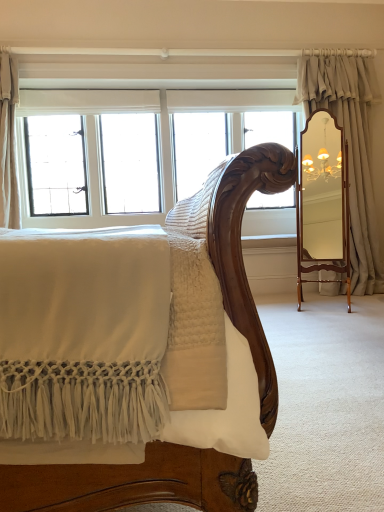
Question: From the image's perspective, is white glass window at upper left beneath beige linen curtain at upper left, which is counted as the 2th curtain, starting from the right?

Choices:
 (A) yes
 (B) no

Answer: (A)

Question: Does white glass window at upper left have a smaller size compared to beige linen curtain at upper left, which is counted as the 2th curtain, starting from the right?

Choices:
 (A) yes
 (B) no

Answer: (B)

Question: Is white glass window at upper left completely or partially outside of beige linen curtain at upper left, which is counted as the 2th curtain, starting from the right?

Choices:
 (A) yes
 (B) no

Answer: (A)

Question: Could you tell me if white glass window at upper left is facing beige linen curtain at upper left, which is the 1th curtain in left-to-right order?

Choices:
 (A) yes
 (B) no

Answer: (A)

Question: From the image's perspective, is white glass window at upper left above beige linen curtain at upper left, which is counted as the 2th curtain, starting from the right?

Choices:
 (A) yes
 (B) no

Answer: (B)

Question: From a real-world perspective, is white glass window at upper left physically located above or below satin beige curtain at right, marked as the first curtain in a right-to-left arrangement?

Choices:
 (A) below
 (B) above

Answer: (B)

Question: Based on their positions, is white glass window at upper left located to the left or right of satin beige curtain at right, marked as the first curtain in a right-to-left arrangement?

Choices:
 (A) left
 (B) right

Answer: (A)

Question: Considering their positions, is white glass window at upper left located in front of or behind satin beige curtain at right, marked as the first curtain in a right-to-left arrangement?

Choices:
 (A) behind
 (B) front

Answer: (A)

Question: From the image's perspective, is white glass window at upper left positioned above or below satin beige curtain at right, placed as the second curtain when sorted from left to right?

Choices:
 (A) above
 (B) below

Answer: (A)

Question: In the image, is beige linen curtain at upper left, which is counted as the 2th curtain, starting from the right, positioned in front of or behind satin beige curtain at right, placed as the second curtain when sorted from left to right?

Choices:
 (A) front
 (B) behind

Answer: (A)

Question: Is beige linen curtain at upper left, which is the 1th curtain in left-to-right order, inside or outside of satin beige curtain at right, marked as the first curtain in a right-to-left arrangement?

Choices:
 (A) inside
 (B) outside

Answer: (B)

Question: From a real-world perspective, is beige linen curtain at upper left, which is counted as the 2th curtain, starting from the right, above or below satin beige curtain at right, placed as the second curtain when sorted from left to right?

Choices:
 (A) above
 (B) below

Answer: (A)

Question: Looking at the image, does beige linen curtain at upper left, which is the 1th curtain in left-to-right order, seem bigger or smaller compared to satin beige curtain at right, marked as the first curtain in a right-to-left arrangement?

Choices:
 (A) small
 (B) big

Answer: (A)

Question: From a real-world perspective, is beige linen curtain at upper left, which is the 1th curtain in left-to-right order, physically located above or below white glass window at upper left?

Choices:
 (A) below
 (B) above

Answer: (B)

Question: From their relative heights in the image, would you say beige linen curtain at upper left, which is counted as the 2th curtain, starting from the right, is taller or shorter than white glass window at upper left?

Choices:
 (A) tall
 (B) short

Answer: (B)